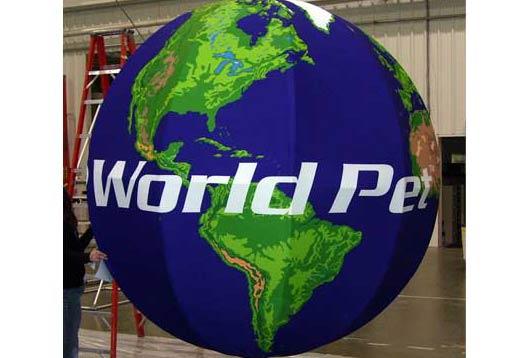
You are a GUI agent. You are given a task and a screenshot of the screen. Output one action in this format:
    pyautogui.click(x=<x>, y=<y>)
    Task: Click on the bottom of ladder
    The image size is (525, 358).
    Given the screenshot: What is the action you would take?
    pyautogui.click(x=141, y=333)